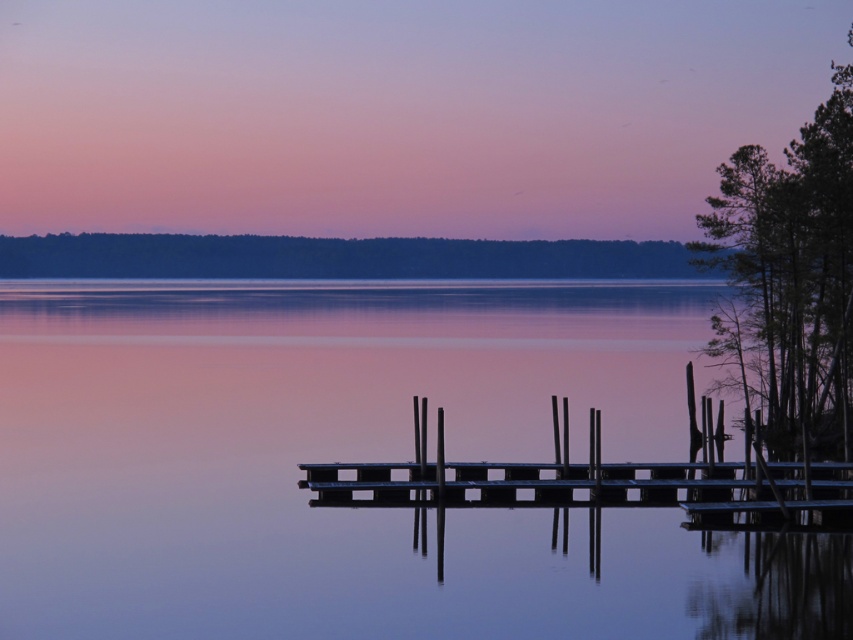
Consider the image. You are standing on the shore looking out at the scene. Which object is closer to you, the smooth water at center or the metallic dock at center?

The smooth water at center is closer to you because it is in front of the metallic dock at center.